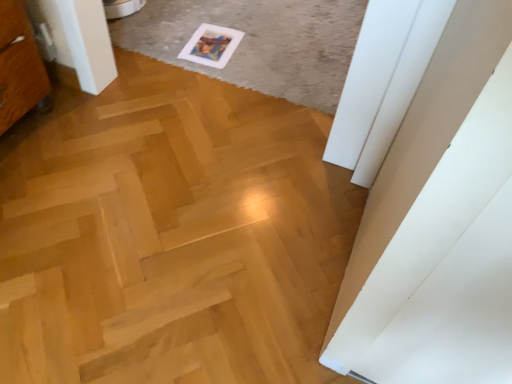
The height and width of the screenshot is (384, 512). Describe the element at coordinates (211, 45) in the screenshot. I see `white paper postcard at upper center` at that location.

Where is `white paper at upper center`? The width and height of the screenshot is (512, 384). white paper at upper center is located at coordinates (257, 42).

Does natural wood plywood at center contain white paper postcard at upper center?

No, white paper postcard at upper center is located outside of natural wood plywood at center.

Is natural wood plywood at center turned away from white paper postcard at upper center?

No, natural wood plywood at center is not facing the opposite direction of white paper postcard at upper center.

Based on their positions, is natural wood plywood at center located to the left or right of white paper postcard at upper center?

Clearly, natural wood plywood at center is on the left of white paper postcard at upper center in the image.

Does natural wood plywood at center have a lesser height compared to white paper postcard at upper center?

No.

Where is `plain above the white paper postcard at upper center (from the image's perspective)`? This screenshot has width=512, height=384. plain above the white paper postcard at upper center (from the image's perspective) is located at coordinates (257, 42).

From the image's perspective, who appears lower, white paper at upper center or white paper postcard at upper center?

white paper postcard at upper center appears lower in the image.

Visually, is white paper at upper center positioned to the left or to the right of white paper postcard at upper center?

From the image, it's evident that white paper at upper center is to the right of white paper postcard at upper center.

Considering the sizes of objects white paper at upper center and white paper postcard at upper center in the image provided, who is taller, white paper at upper center or white paper postcard at upper center?

white paper at upper center is taller.

Does point (175, 10) appear closer or farther from the camera than point (19, 235)?

Point (175, 10) appears to be farther away from the viewer than point (19, 235).

Is white paper at upper center oriented towards natural wood plywood at center?

Yes.

In the scene shown: Which object is more forward, white paper at upper center or natural wood plywood at center?

natural wood plywood at center is closer to the camera.

From a real-world perspective, is white paper at upper center positioned over natural wood plywood at center based on gravity?

Correct, in the physical world, white paper at upper center is higher than natural wood plywood at center.

Measure the distance from natural wood plywood at center to white paper at upper center.

natural wood plywood at center is 25.45 inches from white paper at upper center.

Is point (280, 379) farther from viewer compared to point (183, 9)?

No, it is not.

Considering the positions of objects natural wood plywood at center and white paper at upper center in the image provided, who is behind, natural wood plywood at center or white paper at upper center?

Positioned behind is white paper at upper center.

Consider the image. How different are the orientations of natural wood plywood at center and white paper at upper center in degrees?

There is a 179-degree angle between the facing directions of natural wood plywood at center and white paper at upper center.

At what (x,y) coordinates should I click in order to perform the action: click on plain on the right of white paper postcard at upper center. Please return your answer as a coordinate pair (x, y). Image resolution: width=512 pixels, height=384 pixels. Looking at the image, I should click on (257, 42).

From a real-world perspective, who is located lower, white paper postcard at upper center or white paper at upper center?

From a 3D spatial view, white paper postcard at upper center is below.

Is white paper postcard at upper center situated inside white paper at upper center or outside?

white paper postcard at upper center fits inside white paper at upper center.

Which object is thinner, white paper postcard at upper center or natural wood plywood at center?

white paper postcard at upper center is thinner.

Is point (237, 41) behind point (273, 279)?

Yes, point (237, 41) is behind point (273, 279).

Does white paper postcard at upper center come behind natural wood plywood at center?

Yes, white paper postcard at upper center is further from the camera.

From the image's perspective, who appears lower, white paper postcard at upper center or natural wood plywood at center?

From the image's view, natural wood plywood at center is below.

In order to click on postcard behind the natural wood plywood at center in this screenshot , I will do `click(211, 45)`.

I want to click on plain located on the right of white paper postcard at upper center, so click(257, 42).

Based on their spatial positions, is white paper at upper center or white paper postcard at upper center further from natural wood plywood at center?

Among the two, white paper postcard at upper center is located further to natural wood plywood at center.

In the scene shown: Based on their spatial positions, is white paper at upper center or natural wood plywood at center closer to white paper postcard at upper center?

Among the two, white paper at upper center is located nearer to white paper postcard at upper center.

Considering their positions, is white paper postcard at upper center positioned further to natural wood plywood at center than white paper at upper center?

Based on the image, white paper postcard at upper center appears to be further to natural wood plywood at center.

Considering their positions, is natural wood plywood at center positioned closer to white paper postcard at upper center than white paper at upper center?

white paper at upper center is positioned closer to the anchor white paper postcard at upper center.

When comparing their distances from white paper at upper center, does white paper postcard at upper center or natural wood plywood at center seem closer?

The object closer to white paper at upper center is white paper postcard at upper center.

Estimate the real-world distances between objects in this image. Which object is further from white paper at upper center, natural wood plywood at center or white paper postcard at upper center?

The object further to white paper at upper center is natural wood plywood at center.

I want to click on postcard between white paper at upper center and natural wood plywood at center from top to bottom, so click(211, 45).